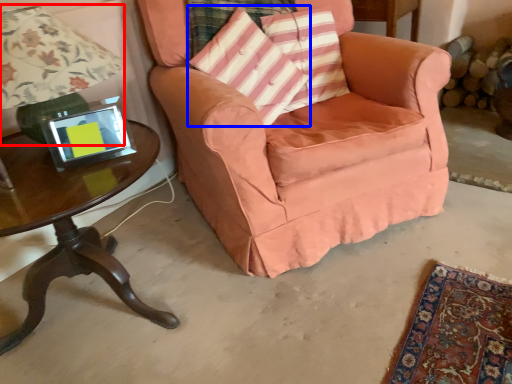
Question: Which point is closer to the camera, lamp (highlighted by a red box) or throw pillow (highlighted by a blue box)?

Choices:
 (A) lamp
 (B) throw pillow

Answer: (A)